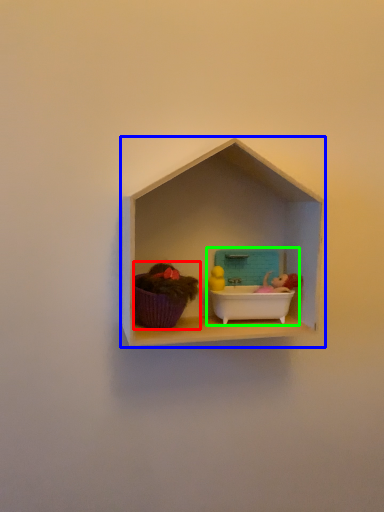
Question: Which object is positioned closest to toy (highlighted by a red box)? Select from shelf (highlighted by a blue box) and lunch box (highlighted by a green box).

Choices:
 (A) shelf
 (B) lunch box

Answer: (A)